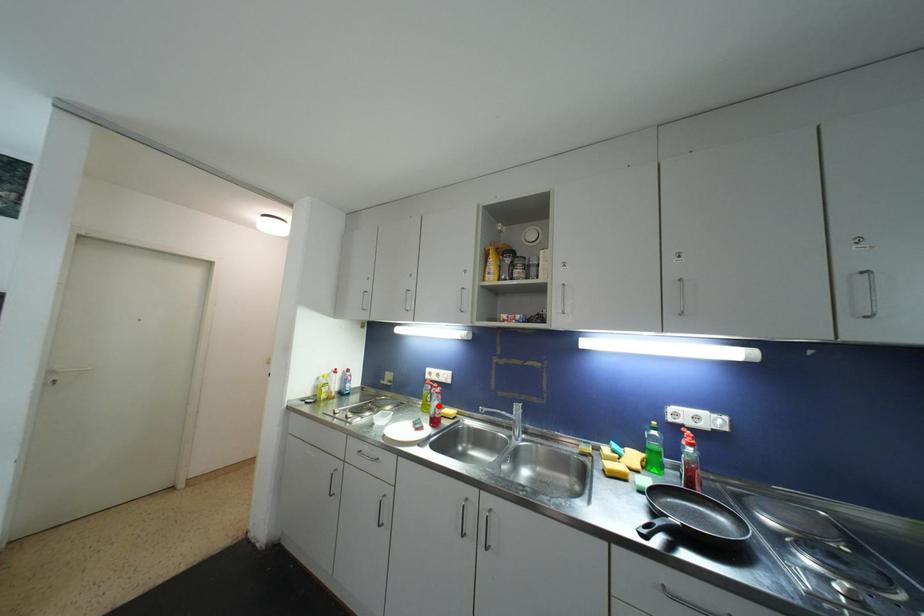
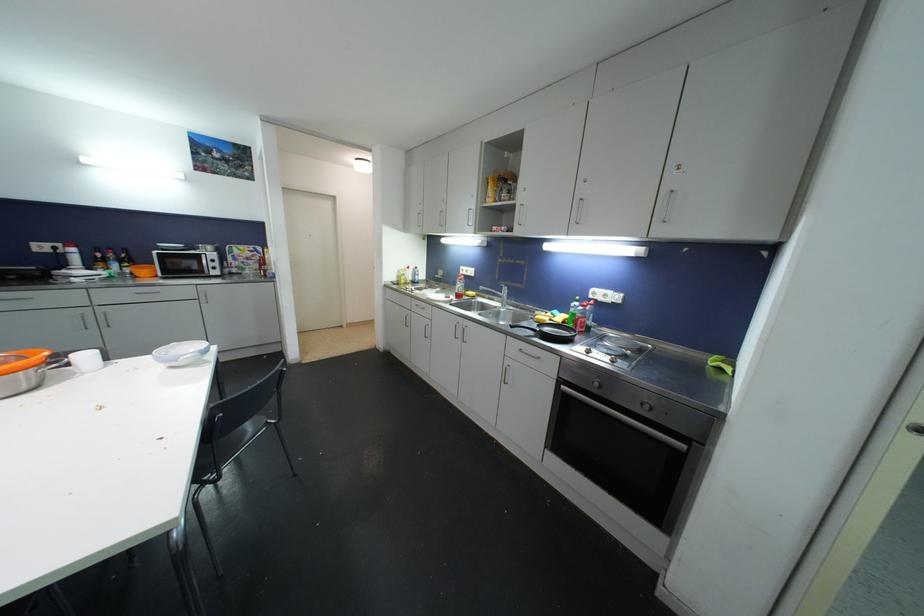
Where in the second image is the point corresponding to the highlighted location from the first image?

(463, 288)